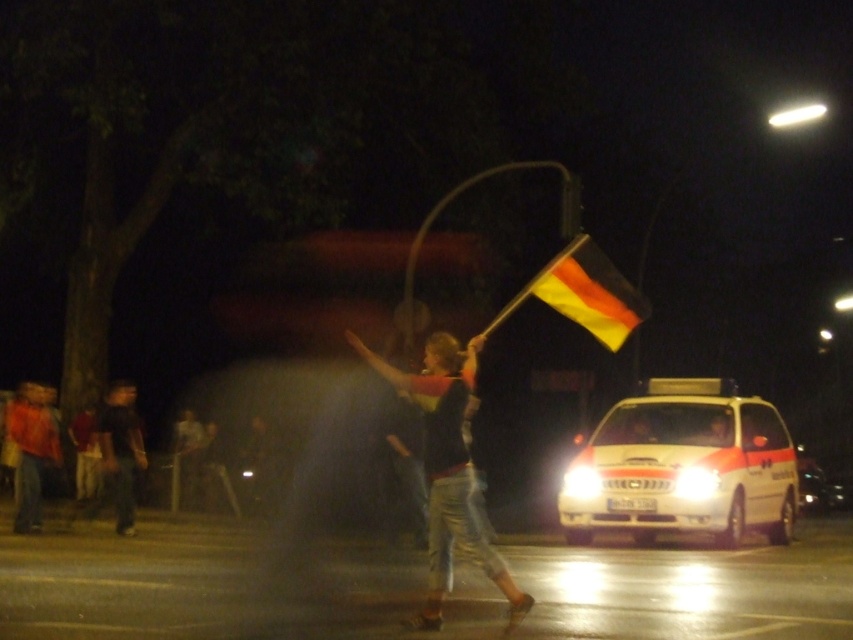
Can you confirm if white glossy ambulance at center is smaller than yellow-orange fabric flag at upper right?

Correct, white glossy ambulance at center occupies less space than yellow-orange fabric flag at upper right.

Measure the distance between white glossy ambulance at center and camera.

white glossy ambulance at center and camera are 12.96 meters apart from each other.

Find the location of a particular element. white glossy ambulance at center is located at coordinates (683, 467).

Between white glossy ambulance at center and dark gray jeans at left, which one has more height?

With more height is dark gray jeans at left.

Is white glossy ambulance at center below dark gray jeans at left?

Yes.

This screenshot has width=853, height=640. I want to click on white glossy ambulance at center, so click(x=683, y=467).

The image size is (853, 640). In order to click on white glossy ambulance at center in this screenshot , I will do `click(683, 467)`.

Between matte black shirt at center and dark gray jeans at left, which one is positioned lower?

dark gray jeans at left is below.

Does matte black shirt at center appear on the right side of dark gray jeans at left?

Correct, you'll find matte black shirt at center to the right of dark gray jeans at left.

Who is more forward, (x=440, y=502) or (x=97, y=426)?

Positioned in front is point (x=440, y=502).

Image resolution: width=853 pixels, height=640 pixels. I want to click on matte black shirt at center, so click(x=447, y=467).